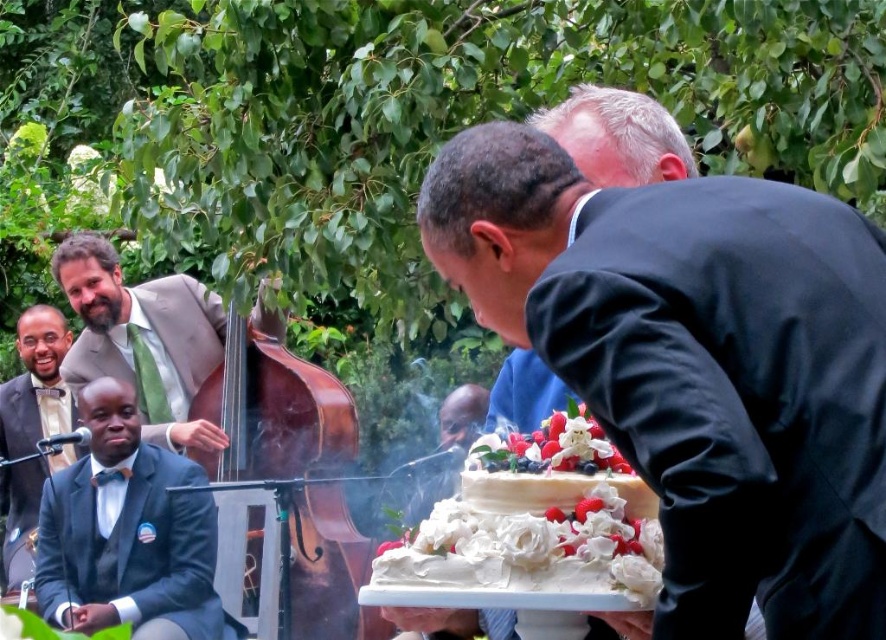
Describe the element at coordinates (142, 339) in the screenshot. This screenshot has height=640, width=886. I see `light brown suit at upper left` at that location.

Is light brown suit at upper left above matte green bow tie at left?

Yes, light brown suit at upper left is above matte green bow tie at left.

Is point (218, 339) less distant than point (28, 461)?

Yes, point (218, 339) is in front of point (28, 461).

You are a GUI agent. You are given a task and a screenshot of the screen. Output one action in this format:
    pyautogui.click(x=<x>, y=<y>)
    Task: Click on the light brown suit at upper left
    The width and height of the screenshot is (886, 640).
    Given the screenshot: What is the action you would take?
    pyautogui.click(x=142, y=339)

Who is taller, matte black suit at lower left or matte green bow tie at left?

matte green bow tie at left is taller.

Who is positioned more to the right, matte black suit at lower left or matte green bow tie at left?

matte black suit at lower left is more to the right.

Which is behind, point (208, 589) or point (28, 532)?

The point (28, 532) is more distant.

Where is `matte black suit at lower left`? Image resolution: width=886 pixels, height=640 pixels. matte black suit at lower left is located at coordinates (128, 532).

Between white cream cake at center and light brown suit at upper left, which one has more height?

light brown suit at upper left

Does point (374, 570) come behind point (103, 317)?

No, (374, 570) is in front of (103, 317).

The image size is (886, 640). What are the coordinates of `white cream cake at center` in the screenshot? It's located at (537, 518).